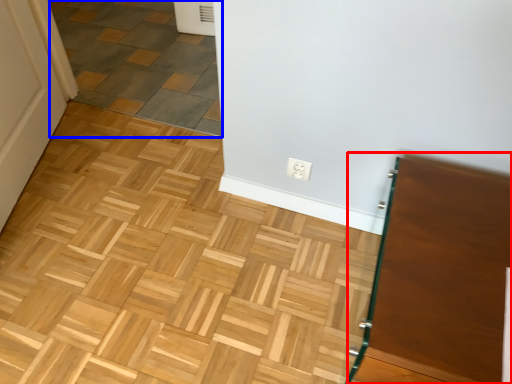
Question: Which of the following is the closest to the observer, vanity (highlighted by a red box) or tile (highlighted by a blue box)?

Choices:
 (A) vanity
 (B) tile

Answer: (A)